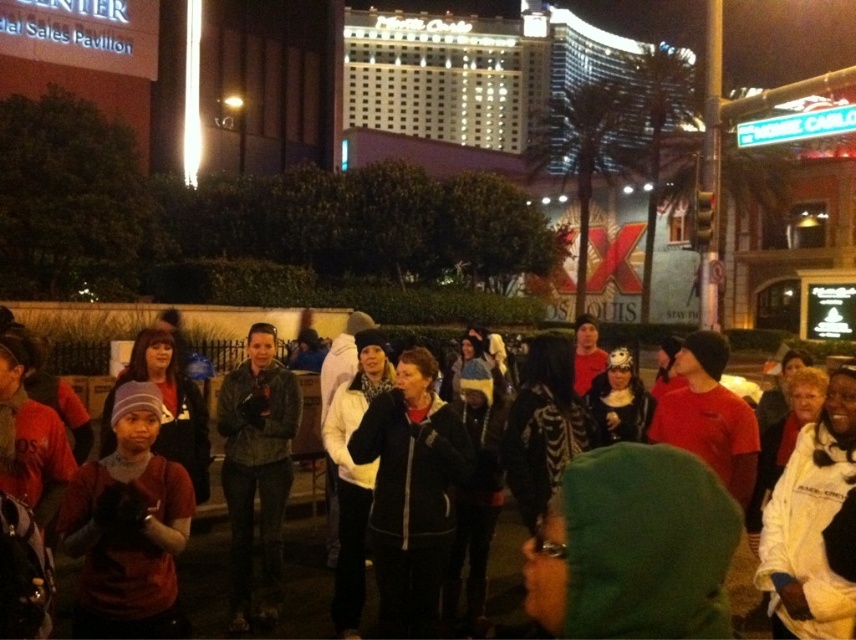
Question: Which object is the farthest from the leather jacket at center?

Choices:
 (A) matte red shirt at center
 (B) black fleece jacket at center

Answer: (A)

Question: Estimate the real-world distances between objects in this image. Which object is closer to the black fleece jacket at center?

Choices:
 (A) leather jacket at center
 (B) matte red shirt at center

Answer: (A)

Question: Is black fleece jacket at center above leather jacket at center?

Choices:
 (A) no
 (B) yes

Answer: (B)

Question: Observing the image, what is the correct spatial positioning of black fleece jacket at center in reference to leather jacket at center?

Choices:
 (A) below
 (B) above

Answer: (B)

Question: Which object is the closest to the leather jacket at center?

Choices:
 (A) matte red shirt at center
 (B) black fleece jacket at center

Answer: (B)

Question: Can you confirm if matte red shirt at center is wider than black fleece jacket at center?

Choices:
 (A) no
 (B) yes

Answer: (A)